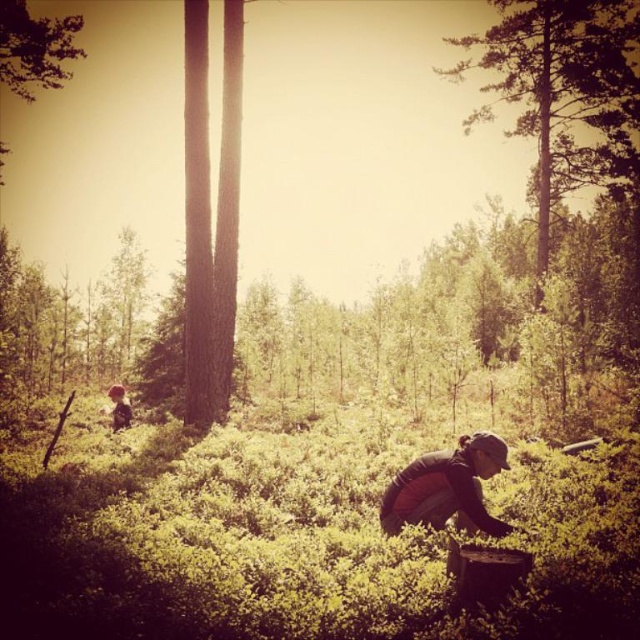
Between point (193, 360) and point (397, 502), which one is positioned behind?

Positioned behind is point (193, 360).

Where is `smooth bark tree at center`? The width and height of the screenshot is (640, 640). smooth bark tree at center is located at coordinates (209, 212).

Does point (196, 26) come closer to viewer compared to point (426, 477)?

No, (196, 26) is further to viewer.

Locate an element on the screen. smooth bark tree at center is located at coordinates (209, 212).

What do you see at coordinates (566, 90) in the screenshot? The width and height of the screenshot is (640, 640). I see `green leafy tree at upper right` at bounding box center [566, 90].

Is green leafy tree at upper right taller than smooth bark tree at center?

Indeed, green leafy tree at upper right has a greater height compared to smooth bark tree at center.

Where is `green leafy tree at upper right`? green leafy tree at upper right is located at coordinates (566, 90).

Who is more forward, (193, 196) or (116, 401)?

Positioned in front is point (193, 196).

In the scene shown: Does smooth bark tree at center appear under brown fur dog at lower left?

Incorrect, smooth bark tree at center is not positioned below brown fur dog at lower left.

Does point (212, 298) lie behind point (124, 426)?

Yes, it is behind point (124, 426).

Identify the location of smooth bark tree at center. (209, 212).